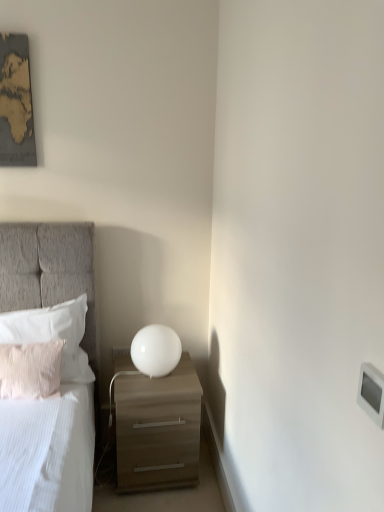
Question: Considering the relative sizes of white plastic electric outlet at lower right and white soft pillow at left, the 2th pillow from the front, in the image provided, is white plastic electric outlet at lower right shorter than white soft pillow at left, the 2th pillow from the front,?

Choices:
 (A) no
 (B) yes

Answer: (B)

Question: From a real-world perspective, is white plastic electric outlet at lower right positioned under white soft pillow at left, placed as the first pillow when sorted from back to front, based on gravity?

Choices:
 (A) yes
 (B) no

Answer: (A)

Question: Is white plastic electric outlet at lower right behind white soft pillow at left, the 2th pillow from the front?

Choices:
 (A) no
 (B) yes

Answer: (B)

Question: Is white plastic electric outlet at lower right taller than white soft pillow at left, placed as the first pillow when sorted from back to front?

Choices:
 (A) no
 (B) yes

Answer: (A)

Question: Can you confirm if white plastic electric outlet at lower right is smaller than white soft pillow at left, the 2th pillow from the front?

Choices:
 (A) no
 (B) yes

Answer: (B)

Question: Is white glossy sphere at center wider or thinner than white soft pillow at left, the 2th pillow from the front?

Choices:
 (A) wide
 (B) thin

Answer: (A)

Question: From a real-world perspective, is white glossy sphere at center positioned above or below white soft pillow at left, placed as the first pillow when sorted from back to front?

Choices:
 (A) below
 (B) above

Answer: (A)

Question: Considering the positions of white glossy sphere at center and white soft pillow at left, the 2th pillow from the front, in the image, is white glossy sphere at center taller or shorter than white soft pillow at left, the 2th pillow from the front,?

Choices:
 (A) tall
 (B) short

Answer: (B)

Question: From the image's perspective, is white glossy sphere at center above or below white soft pillow at left, placed as the first pillow when sorted from back to front?

Choices:
 (A) above
 (B) below

Answer: (B)

Question: Looking at the image, does white glossy sphere at center seem bigger or smaller compared to white plastic light switch at upper right?

Choices:
 (A) big
 (B) small

Answer: (A)

Question: Is point (172, 329) positioned closer to the camera than point (372, 407)?

Choices:
 (A) closer
 (B) farther

Answer: (B)

Question: Considering the positions of white glossy sphere at center and white plastic light switch at upper right in the image, is white glossy sphere at center wider or thinner than white plastic light switch at upper right?

Choices:
 (A) thin
 (B) wide

Answer: (B)

Question: In the image, is white glossy sphere at center positioned in front of or behind white plastic light switch at upper right?

Choices:
 (A) behind
 (B) front

Answer: (A)

Question: Considering the positions of white plastic electric outlet at lower right and white soft pillow at left, the 2th pillow from the front, in the image, is white plastic electric outlet at lower right wider or thinner than white soft pillow at left, the 2th pillow from the front,?

Choices:
 (A) wide
 (B) thin

Answer: (B)

Question: From a real-world perspective, is white plastic electric outlet at lower right physically located above or below white soft pillow at left, the 2th pillow from the front?

Choices:
 (A) below
 (B) above

Answer: (A)